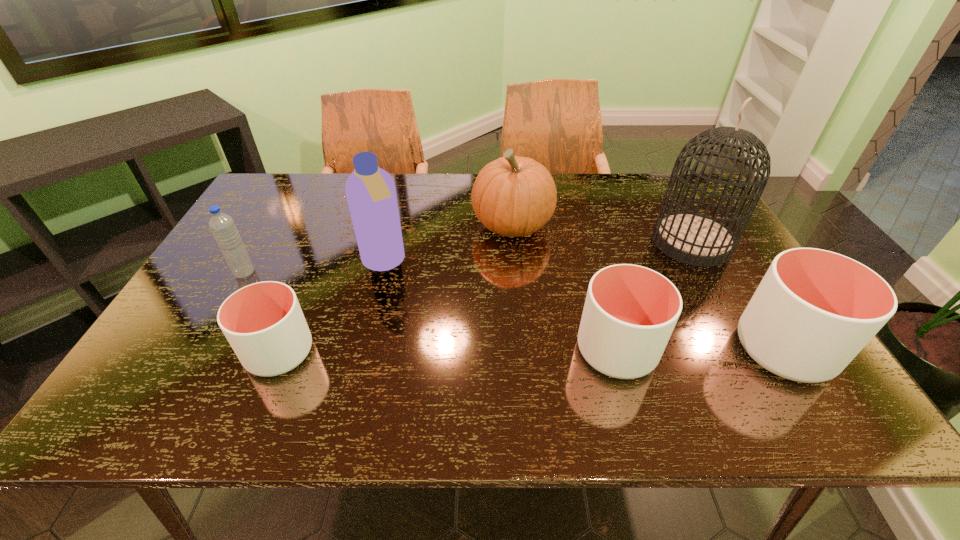
Find the location of a particular element. The height and width of the screenshot is (540, 960). vacant area that lies between the rightmost cup and the second shortest object is located at coordinates (700, 349).

Locate an element on the screen. The width and height of the screenshot is (960, 540). vacant area that lies between the second cup from right to left and the sixth object from right to left is located at coordinates (448, 351).

Where is `vacant area that lies between the second tallest object and the second shortest object`? vacant area that lies between the second tallest object and the second shortest object is located at coordinates (500, 306).

I want to click on vacant point located between the sixth tallest object and the shampoo, so click(500, 306).

Find the location of `vacant space in between the second tallest cup and the pumpkin`. vacant space in between the second tallest cup and the pumpkin is located at coordinates (564, 287).

The width and height of the screenshot is (960, 540). Find the location of `empty space between the water bottle and the second shortest object`. empty space between the water bottle and the second shortest object is located at coordinates (430, 311).

Locate an element on the screen. free space between the birdcage and the leftmost object is located at coordinates (468, 257).

This screenshot has height=540, width=960. In order to click on vacant area between the water bottle and the rightmost cup in this screenshot , I will do `click(515, 310)`.

Point out which object is positioned as the fifth nearest to the shortest object. Please provide its 2D coordinates. Your answer should be formatted as a tuple, i.e. [(x, y)], where the tuple contains the x and y coordinates of a point satisfying the conditions above.

[(692, 238)]

Identify which object is the second nearest to the rightmost cup. Please provide its 2D coordinates. Your answer should be formatted as a tuple, i.e. [(x, y)], where the tuple contains the x and y coordinates of a point satisfying the conditions above.

[(630, 311)]